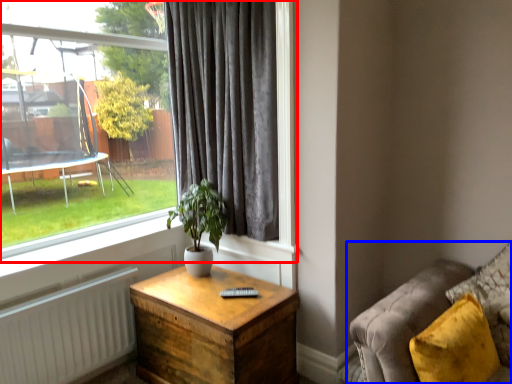
Question: Among these objects, which one is farthest to the camera, window (highlighted by a red box) or studio couch (highlighted by a blue box)?

Choices:
 (A) window
 (B) studio couch

Answer: (A)